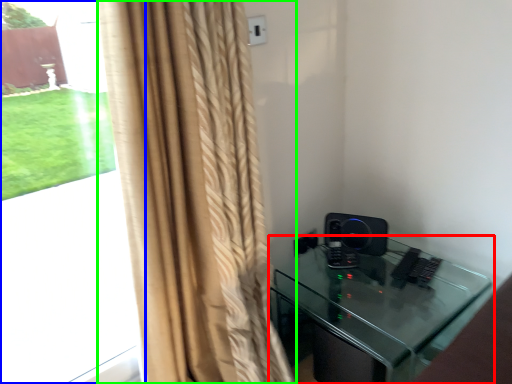
Question: Based on their relative distances, which object is farther from furniture (highlighted by a red box)? Choose from bay window (highlighted by a blue box) and curtain (highlighted by a green box).

Choices:
 (A) bay window
 (B) curtain

Answer: (A)